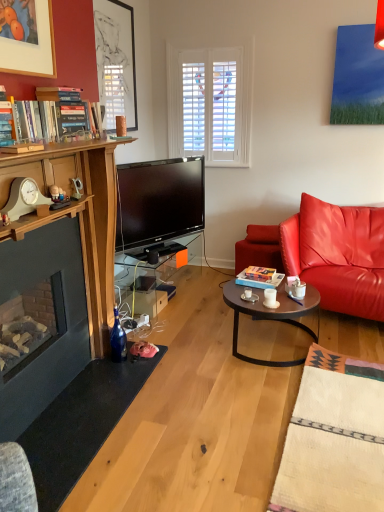
The image size is (384, 512). Describe the element at coordinates (272, 316) in the screenshot. I see `wooden round table at center` at that location.

The height and width of the screenshot is (512, 384). I want to click on matte silver phone at left, so click(x=77, y=188).

What is the approximate height of hardcover book at center, the 1th book in the back-to-front sequence?

The height of hardcover book at center, the 1th book in the back-to-front sequence, is 3.44 inches.

Measure the distance between point (x=178, y=243) and camera.

Point (x=178, y=243) is 3.84 meters away from camera.

Find the location of a particular element. transparent glass table at center is located at coordinates (149, 277).

The image size is (384, 512). What are the coordinates of `wooden round table at center` in the screenshot? It's located at (272, 316).

Looking at this image, is white wooden clock at left placed right next to hardcover book at center, the first book when ordered from bottom to top?

white wooden clock at left is not next to hardcover book at center, the first book when ordered from bottom to top, and they're not touching.

Looking at this image, how many degrees apart are the facing directions of white wooden clock at left and hardcover book at center, the 1th book in the back-to-front sequence?

The facing directions of white wooden clock at left and hardcover book at center, the 1th book in the back-to-front sequence, are 99 degrees apart.

From the picture: Considering the relative sizes of white wooden clock at left and hardcover book at center, the first book when ordered from bottom to top, in the image provided, is white wooden clock at left taller than hardcover book at center, the first book when ordered from bottom to top,?

Correct, white wooden clock at left is much taller as hardcover book at center, the first book when ordered from bottom to top.

Is white wooden clock at left bigger than hardcover book at center, which is the 2th book in left-to-right order?

No, white wooden clock at left is not bigger than hardcover book at center, which is the 2th book in left-to-right order.

Does hardcover book at center, marked as the 2th book in a top-to-bottom arrangement, have a greater height compared to matte silver phone at left?

No.

Is hardcover book at center, which is the 2th book from front to back, oriented towards matte silver phone at left?

No, hardcover book at center, which is the 2th book from front to back, is not facing towards matte silver phone at left.

Which is in front, point (249, 269) or point (79, 193)?

Point (79, 193)

Is hardcover book at center, acting as the first book starting from the right, thinner than matte silver phone at left?

In fact, hardcover book at center, acting as the first book starting from the right, might be wider than matte silver phone at left.

Is wooden round table at center positioned behind matte black picture frame at upper left?

No, wooden round table at center is closer to the camera.

Can you confirm if wooden round table at center is bigger than matte black picture frame at upper left?

Yes.

Which is less distant, (x=249, y=305) or (x=116, y=15)?

Clearly, point (x=249, y=305) is closer to the camera than point (x=116, y=15).

Is white ceramic mug at center spatially inside wooden round table at center, or outside of it?

white ceramic mug at center exists outside the volume of wooden round table at center.

Can you confirm if white ceramic mug at center is shorter than wooden round table at center?

Correct, white ceramic mug at center is not as tall as wooden round table at center.

The width and height of the screenshot is (384, 512). I want to click on coffee cup above the wooden round table at center (from a real-world perspective), so click(270, 298).

Based on the photo, relative to wooden round table at center, is white ceramic mug at center in front or behind?

white ceramic mug at center is behind wooden round table at center.

Locate an element on the screen. The image size is (384, 512). coffee cup beneath the matte black picture frame at upper left (from a real-world perspective) is located at coordinates pos(270,298).

Which object is wider, matte black picture frame at upper left or white ceramic mug at center?

With larger width is white ceramic mug at center.

In the scene shown: Between matte black picture frame at upper left and white ceramic mug at center, which one appears on the right side from the viewer's perspective?

From the viewer's perspective, white ceramic mug at center appears more on the right side.

Does point (9, 202) come farther from viewer compared to point (114, 319)?

No, (9, 202) is closer to viewer.

Which is in front, white wooden clock at left or blue glass bottle at lower left?

Positioned in front is white wooden clock at left.

Is the surface of white wooden clock at left in direct contact with blue glass bottle at lower left?

white wooden clock at left and blue glass bottle at lower left are clearly separated.

Is leather cushion at right in front of hardcover book at center, which is the 2th book from front to back?

Yes, leather cushion at right is closer to the camera.

Based on the photo, how much distance is there between leather cushion at right and hardcover book at center, the first book when ordered from bottom to top?

leather cushion at right and hardcover book at center, the first book when ordered from bottom to top, are 20.25 inches apart.

From the image's perspective, which one is positioned lower, leather cushion at right or hardcover book at center, which is the 2th book in left-to-right order?

hardcover book at center, which is the 2th book in left-to-right order.

The height and width of the screenshot is (512, 384). Identify the location of cushion located on the right of hardcover book at center, marked as the 2th book in a top-to-bottom arrangement. (338, 255).

Identify the location of clock above the hardcover book at center, marked as the 2th book in a top-to-bottom arrangement (from the image's perspective). This screenshot has width=384, height=512. (24, 198).

In order to click on corded phone in front of the hardcover book at center, acting as the first book starting from the right in this screenshot , I will do `click(77, 188)`.

Looking at the image, which one is located further to white wooden clock at left, leather cushion at right or hardcover book at center, marked as the 2th book in a top-to-bottom arrangement?

leather cushion at right lies further to white wooden clock at left than the other object.

Estimate the real-world distances between objects in this image. Which object is closer to hardcover book at center, marked as the 2th book in a top-to-bottom arrangement, hardcover books at left, the second book in the bottom-to-top sequence, or transparent glass table at center?

transparent glass table at center.

Which object lies nearer to the anchor point hardcover book at center, which is the 2th book from front to back, wooden round table at center or white ceramic mug at center?

The object closer to hardcover book at center, which is the 2th book from front to back, is white ceramic mug at center.

Based on their spatial positions, is wooden round table at center or leather cushion at right closer to hardcover book at center, the 1th book in the back-to-front sequence?

wooden round table at center is closer to hardcover book at center, the 1th book in the back-to-front sequence.

When comparing their distances from matte silver phone at left, does transparent glass table at center or blue glass bottle at lower left seem closer?

blue glass bottle at lower left lies closer to matte silver phone at left than the other object.

Which object lies further to the anchor point hardcover books at left, acting as the 1th book starting from the top, blue glass bottle at lower left or hardcover book at center, the first book when ordered from bottom to top?

hardcover book at center, the first book when ordered from bottom to top, lies further to hardcover books at left, acting as the 1th book starting from the top, than the other object.

When comparing their distances from transparent glass table at center, does leather cushion at right or blue glass bottle at lower left seem further?

leather cushion at right.

Considering their positions, is wooden round table at center positioned further to white wooden clock at left than blue glass bottle at lower left?

wooden round table at center lies further to white wooden clock at left than the other object.

The width and height of the screenshot is (384, 512). I want to click on coffee table situated between white wooden clock at left and leather cushion at right from left to right, so click(x=272, y=316).

This screenshot has width=384, height=512. What are the coordinates of `bottle between white wooden clock at left and white ceramic mug at center from left to right` in the screenshot? It's located at (118, 340).

The height and width of the screenshot is (512, 384). Find the location of `coffee table between white wooden clock at left and transparent glass table at center in the front-back direction`. coffee table between white wooden clock at left and transparent glass table at center in the front-back direction is located at coordinates (272, 316).

Image resolution: width=384 pixels, height=512 pixels. Find the location of `table between matte silver phone at left and white ceramic mug at center from left to right`. table between matte silver phone at left and white ceramic mug at center from left to right is located at coordinates (149, 277).